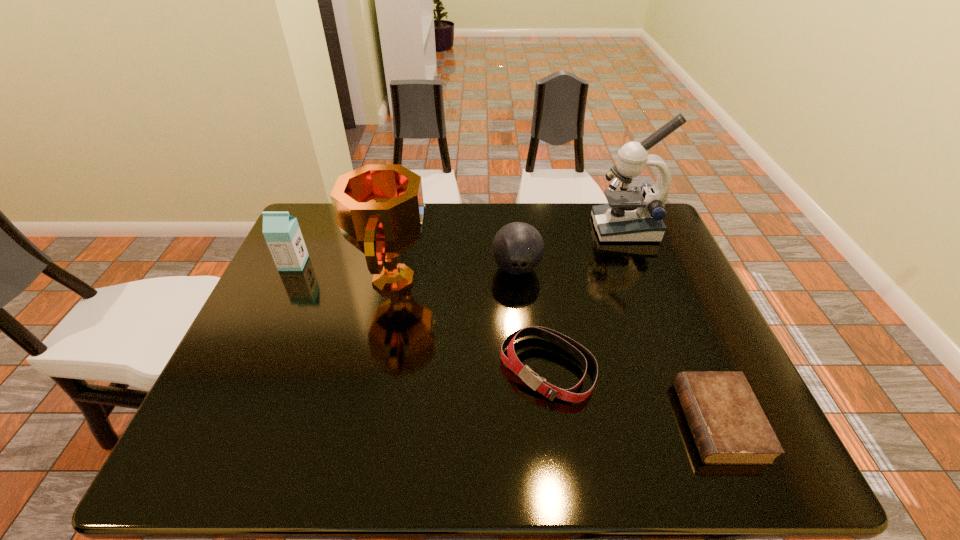
Locate an element on the screen. The width and height of the screenshot is (960, 540). microscope is located at coordinates (632, 215).

You are a GUI agent. You are given a task and a screenshot of the screen. Output one action in this format:
    pyautogui.click(x=<x>, y=<y>)
    Task: Click on the second object from left to right
    The width and height of the screenshot is (960, 540).
    Given the screenshot: What is the action you would take?
    pyautogui.click(x=379, y=208)

Where is `award`? This screenshot has height=540, width=960. award is located at coordinates (379, 208).

Find the location of a particular element. the fourth shortest object is located at coordinates (282, 233).

Where is `milk carton`? The image size is (960, 540). milk carton is located at coordinates (282, 233).

What are the coordinates of `bowling ball` in the screenshot? It's located at (518, 248).

You are a GUI agent. You are given a task and a screenshot of the screen. Output one action in this format:
    pyautogui.click(x=<x>, y=<y>)
    Task: Click on the fifth tallest object
    The height and width of the screenshot is (540, 960).
    Given the screenshot: What is the action you would take?
    pyautogui.click(x=533, y=380)

At what (x,y) coordinates should I click in order to perform the action: click on the shortest object. Please return your answer as a coordinate pair (x, y). The width and height of the screenshot is (960, 540). Looking at the image, I should click on [729, 427].

This screenshot has width=960, height=540. Find the location of `free space located on the left of the microscope`. free space located on the left of the microscope is located at coordinates (518, 228).

You are a GUI agent. You are given a task and a screenshot of the screen. Output one action in this format:
    pyautogui.click(x=<x>, y=<y>)
    Task: Click on the vacant region located on the side of the fifth object from right to left with the star emblem
    
    Given the screenshot: What is the action you would take?
    pyautogui.click(x=505, y=280)